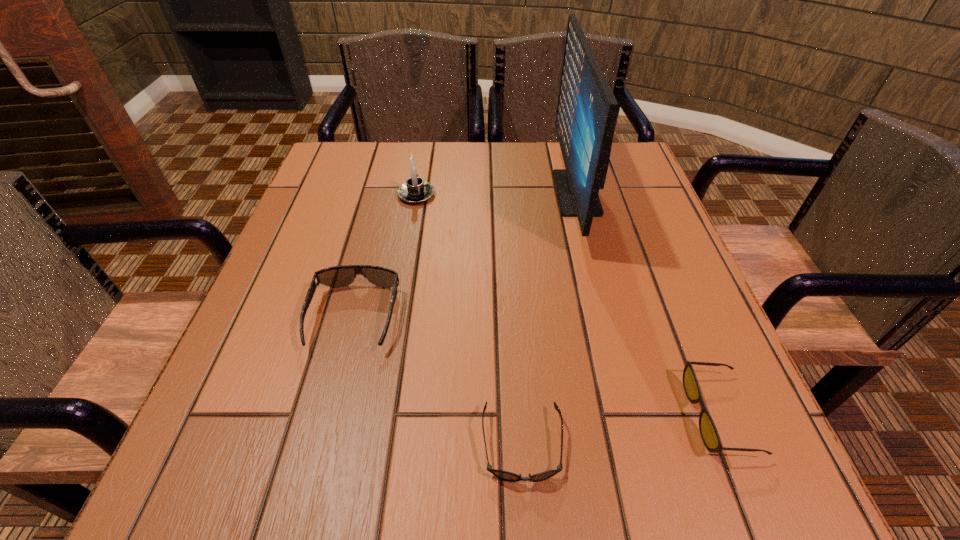
The height and width of the screenshot is (540, 960). Find the location of `computer monitor`. computer monitor is located at coordinates (586, 114).

The width and height of the screenshot is (960, 540). What are the coordinates of `the tallest object` in the screenshot? It's located at (586, 114).

Locate an element on the screen. The width and height of the screenshot is (960, 540). candle holder is located at coordinates (415, 190).

Where is `the farthest sunglasses`? The height and width of the screenshot is (540, 960). the farthest sunglasses is located at coordinates point(337,276).

Image resolution: width=960 pixels, height=540 pixels. In order to click on the third farthest object in this screenshot , I will do `click(337, 276)`.

In order to click on the rightmost sunglasses in this screenshot , I will do `click(708, 431)`.

You are a GUI agent. You are given a task and a screenshot of the screen. Output one action in this format:
    pyautogui.click(x=<x>, y=<y>)
    Task: Click on the rightmost object
    
    Given the screenshot: What is the action you would take?
    pyautogui.click(x=708, y=431)

I want to click on the shortest object, so click(504, 475).

Locate an element on the screen. Image resolution: width=960 pixels, height=540 pixels. the second sunglasses from right to left is located at coordinates (504, 475).

Locate an element on the screen. vacant region located on the screen side of the tallest object is located at coordinates (457, 193).